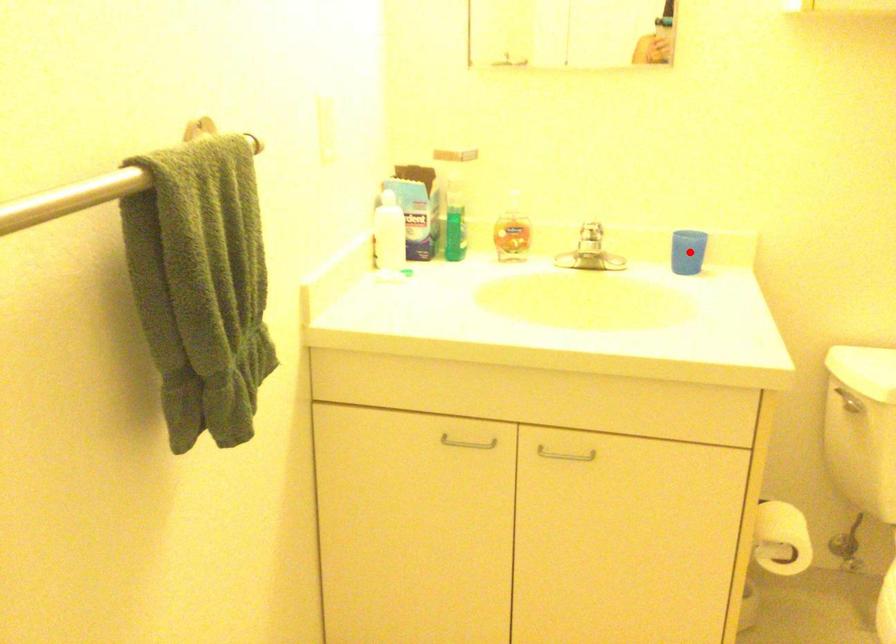
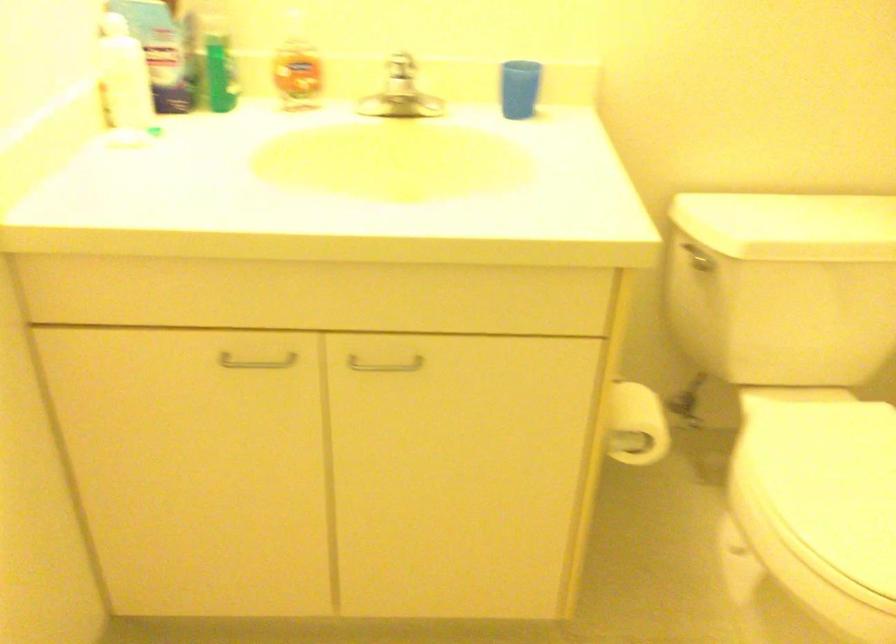
The point at the highlighted location is marked in the first image. Where is the corresponding point in the second image?

(519, 88)